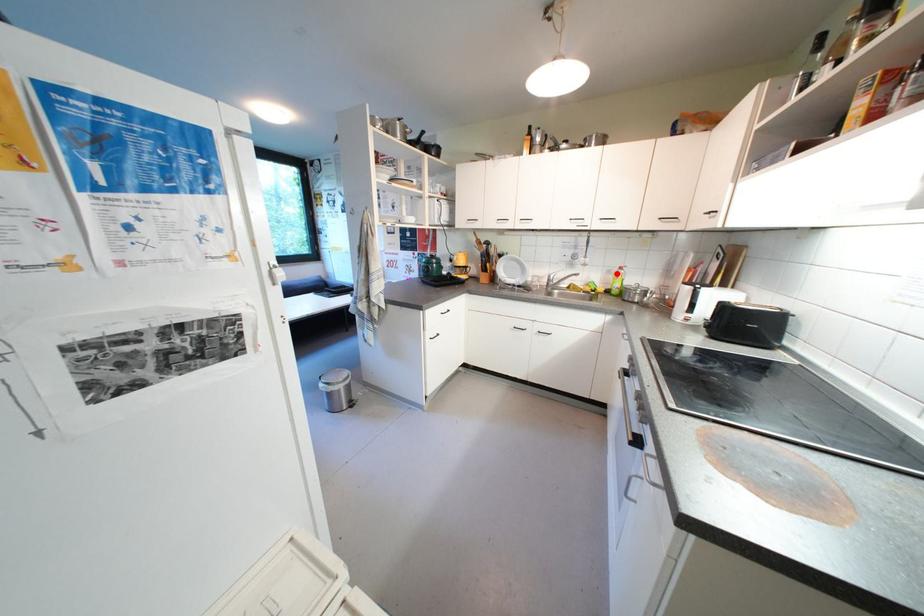
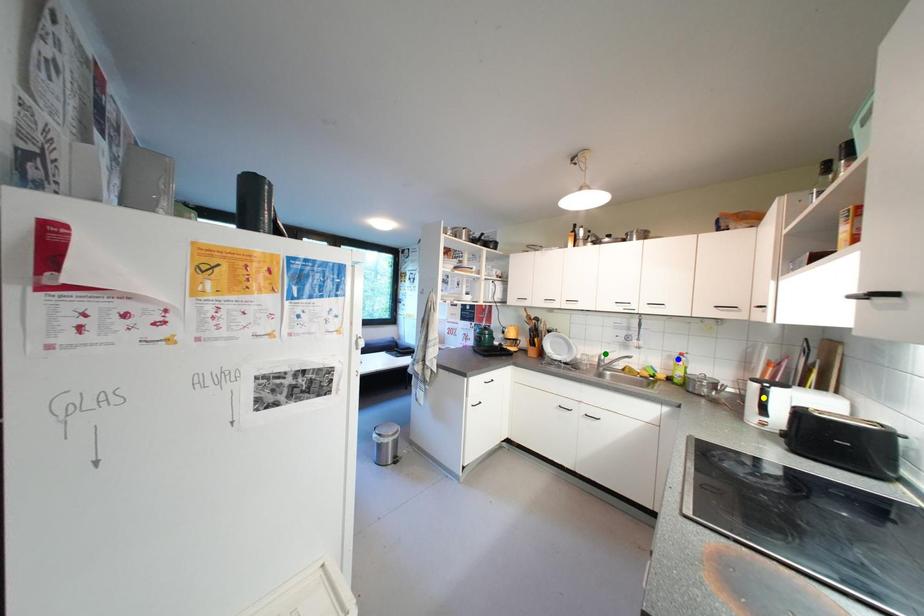
Question: I am providing you with two images of the same scene from different viewpoints. A red point is marked on the first image. You are given multiple points on the second image. Which point in image 2 is actually the same real-world point as the red point in image 1?

Choices:
 (A) green point
 (B) yellow point
 (C) blue point

Answer: (C)